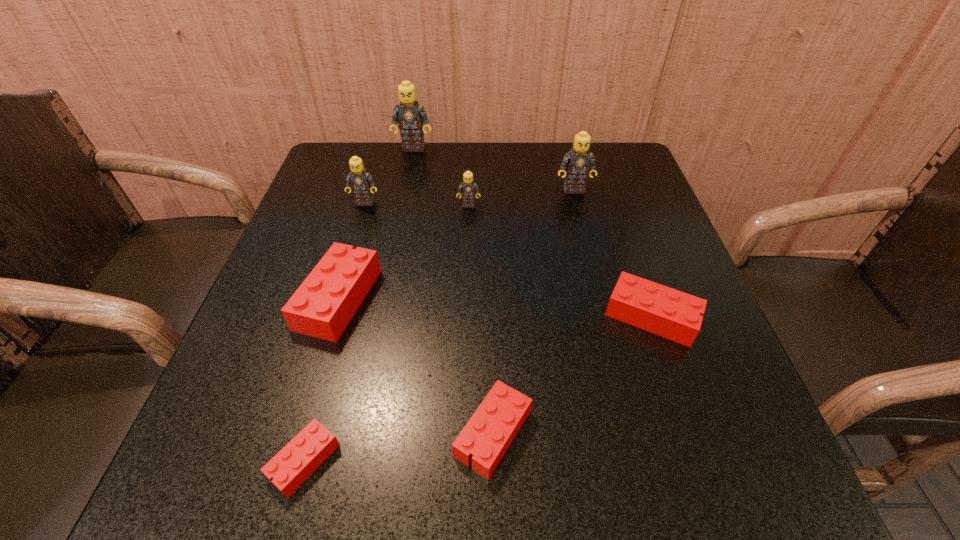
Locate an element on the screen. vacant space at the far right corner is located at coordinates (629, 154).

Image resolution: width=960 pixels, height=540 pixels. I want to click on free space at the near right corner of the desktop, so click(681, 481).

At what (x,y) coordinates should I click in order to perform the action: click on empty space that is in between the shortest object and the fourth shortest Lego. Please return your answer as a coordinate pair (x, y). The width and height of the screenshot is (960, 540). Looking at the image, I should click on [x=322, y=380].

Identify the location of free space between the fourth tallest Lego and the biggest red Lego. (404, 252).

Where is `free space between the third shortest Lego and the rightmost tan Lego`? This screenshot has width=960, height=540. free space between the third shortest Lego and the rightmost tan Lego is located at coordinates (612, 253).

Where is `free area in between the fourth shortest object and the shortest object`? free area in between the fourth shortest object and the shortest object is located at coordinates (322, 380).

This screenshot has height=540, width=960. In order to click on empty space between the sixth tallest Lego and the fifth shortest Lego in this screenshot , I will do `click(560, 261)`.

At what (x,y) coordinates should I click in order to perform the action: click on free spot between the smallest tan Lego and the third biggest tan Lego. Please return your answer as a coordinate pair (x, y). This screenshot has height=540, width=960. Looking at the image, I should click on (417, 204).

Where is `free point between the third biggest tan Lego and the rightmost red Lego`? free point between the third biggest tan Lego and the rightmost red Lego is located at coordinates (508, 259).

Find the location of a particular element. The width and height of the screenshot is (960, 540). vacant area that lies between the fourth shortest Lego and the smallest red Lego is located at coordinates (322, 380).